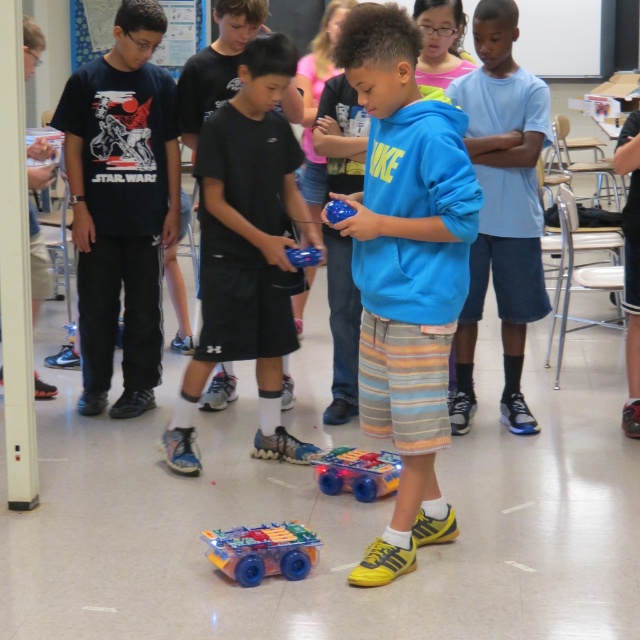
Question: Is black cotton t-shirt at left to the left of blue cotton shirt at center from the viewer's perspective?

Choices:
 (A) no
 (B) yes

Answer: (B)

Question: Which is farther from the translucent plastic toy car at center?

Choices:
 (A) blue cotton shirt at center
 (B) translucent plastic toy car at lower center
 (C) black cotton t-shirt at left
 (D) black matte shorts at center

Answer: (C)

Question: Which is farther from the blue cotton shirt at center?

Choices:
 (A) black matte shorts at center
 (B) translucent plastic toy car at center
 (C) blue fleece hoodie at center
 (D) black cotton t-shirt at left

Answer: (D)

Question: From the image, what is the correct spatial relationship of black matte shorts at center in relation to translucent plastic toy car at center?

Choices:
 (A) right
 (B) left

Answer: (B)

Question: Among these points, which one is farthest from the camera?

Choices:
 (A) tap(257, 557)
 (B) tap(211, 237)
 (C) tap(502, 93)

Answer: (C)

Question: Is black cotton t-shirt at left bigger than translucent plastic toy car at center?

Choices:
 (A) no
 (B) yes

Answer: (B)